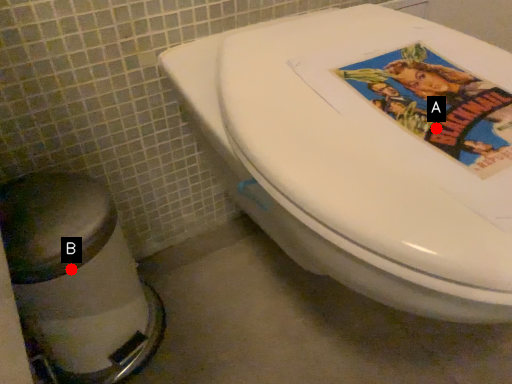
Question: Two points are circled on the image, labeled by A and B beside each circle. Which point appears farthest from the camera in this image?

Choices:
 (A) A is further
 (B) B is further

Answer: (B)